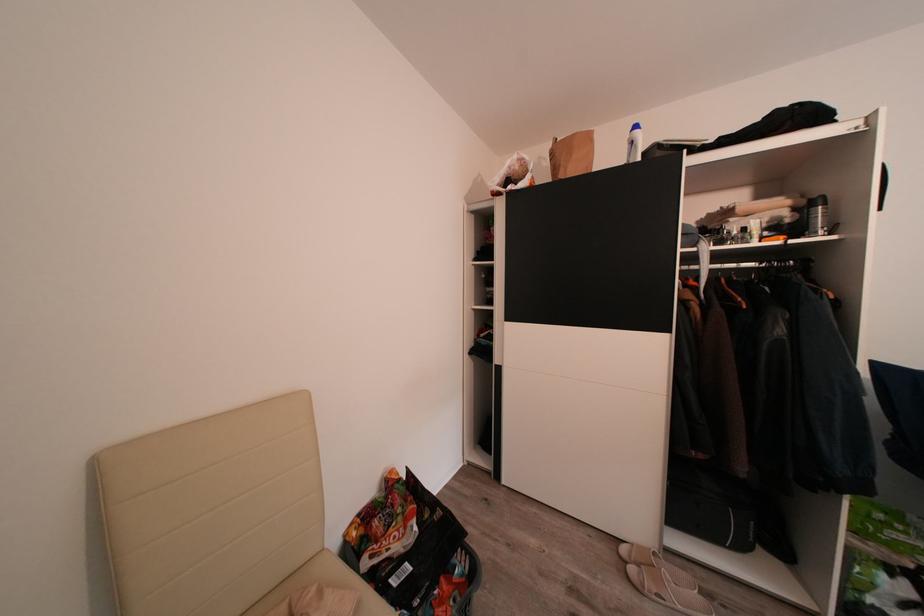
Find where to spray the silver spray can. Please return your answer as a coordinate pair (x, y).

(816, 216)